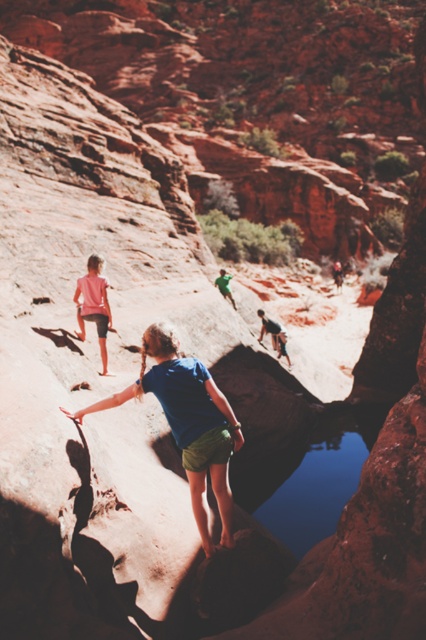
Question: Can you confirm if pink fabric shorts at lower left is positioned above smooth gray rock climber at center?

Choices:
 (A) no
 (B) yes

Answer: (B)

Question: Does blue fabric shorts at center have a smaller size compared to smooth gray rock climber at center?

Choices:
 (A) no
 (B) yes

Answer: (A)

Question: Which point is closer to the camera?

Choices:
 (A) (86, 278)
 (B) (284, 330)

Answer: (A)

Question: Is blue fabric shorts at center thinner than pink fabric shorts at lower left?

Choices:
 (A) yes
 (B) no

Answer: (B)

Question: Among these points, which one is farthest from the camera?

Choices:
 (A) (124, 394)
 (B) (273, 324)

Answer: (B)

Question: Estimate the real-world distances between objects in this image. Which object is farther from the blue fabric shorts at center?

Choices:
 (A) pink fabric shorts at lower left
 (B) smooth gray rock climber at center

Answer: (B)